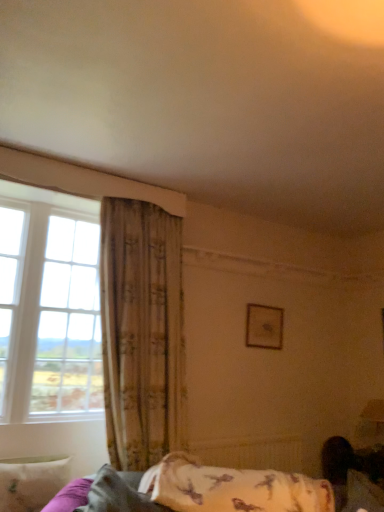
Question: In terms of height, does fluffy white pillow at lower right, which is counted as the first pillow, starting from the right, look taller or shorter compared to white soft pillow at lower left, which is the 1th pillow in left-to-right order?

Choices:
 (A) short
 (B) tall

Answer: (A)

Question: Choose the correct answer: Is fluffy white pillow at lower right, which is the third pillow in left-to-right order, inside white soft pillow at lower left, arranged as the third pillow when viewed from the right, or outside it?

Choices:
 (A) inside
 (B) outside

Answer: (B)

Question: Estimate the real-world distances between objects in this image. Which object is farther from the white soft pillow at lower left, arranged as the third pillow when viewed from the right?

Choices:
 (A) fluffy white pillow at lower right, which is the third pillow in left-to-right order
 (B) fluffy white pillow at lower center, the second pillow from the right
 (C) textured beige curtain at left
 (D) clear glass window at left
 (E) wooden frame at upper center

Answer: (D)

Question: Which object is positioned closest to the white soft pillow at lower left, arranged as the third pillow when viewed from the right?

Choices:
 (A) clear glass window at left
 (B) white matte radiator at lower center
 (C) textured beige curtain at left
 (D) wooden frame at upper center
 (E) fluffy white pillow at lower right, which is the third pillow in left-to-right order

Answer: (C)